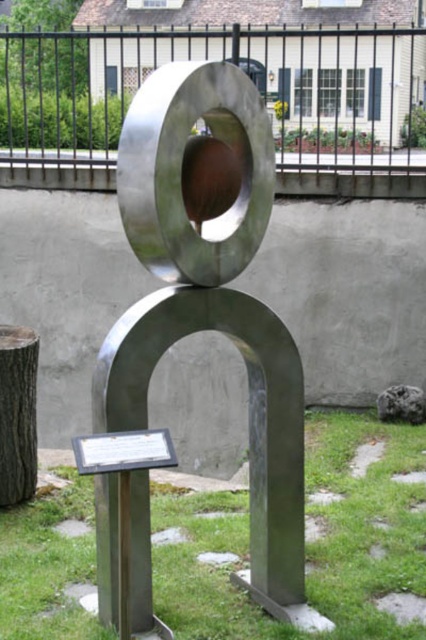
You are an artist planning to photograph the polished metal sculpture at center and the dark brown wood stump at lower left. Which object should you focus on first if you want to capture the one that takes up more space in the frame?

The polished metal sculpture at center has a larger size compared to the dark brown wood stump at lower left, so you should focus on the polished metal sculpture at center first to capture the one that takes up more space in the frame.

You are standing facing the sculpture and want to place a small decorative rock between the green grass at center and the dark brown wood stump at lower left. Based on their positions, where should you place the rock?

The green grass at center is to the right of the dark brown wood stump at lower left, so you should place the rock between them, to the right of the dark brown wood stump at lower left and to the left of the green grass at center.

You are standing in the courtyard and want to take a photo of the polished metal sculpture at center. Since you want the green grass at center to be visible in the background, is the sculpture positioned in a way that allows this?

The polished metal sculpture at center is in front of green grass at center, so yes, the sculpture is positioned in front of the green grass at center, allowing the grass to be visible in the background.